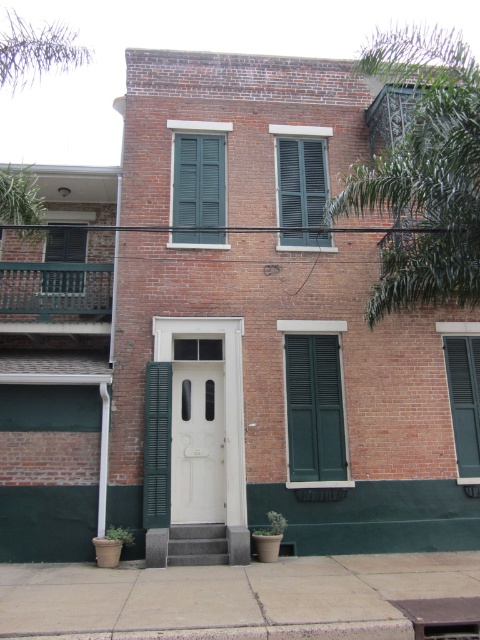
Question: Which object is positioned closest to the green matte shutters at center?

Choices:
 (A) green matte shutter at center
 (B) green matte shutter at right
 (C) white glossy door at center

Answer: (A)

Question: Where is green matte shutters at center located in relation to green matte shutter at right in the image?

Choices:
 (A) below
 (B) above

Answer: (B)

Question: Which point appears closest to the camera in this image?

Choices:
 (A) (333, 458)
 (B) (298, 224)

Answer: (A)

Question: Is green matte shutter at center thinner than green matte shutter at left?

Choices:
 (A) no
 (B) yes

Answer: (A)

Question: Is white glossy door at center positioned at the back of green matte shutter at left?

Choices:
 (A) yes
 (B) no

Answer: (B)

Question: Which of the following is the closest to the observer?

Choices:
 (A) (322, 385)
 (B) (291, 141)

Answer: (A)